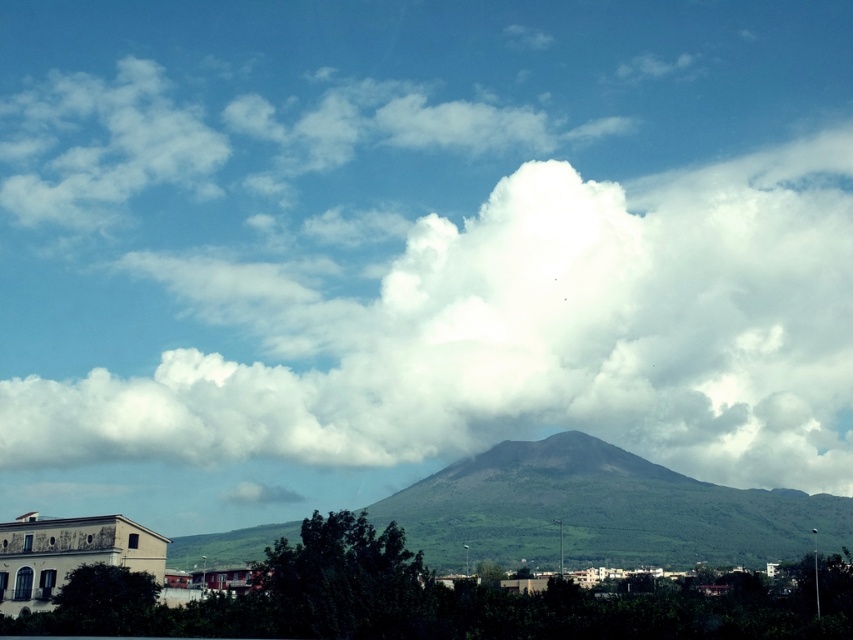
You are an architect designing a new observatory that needs a clear view of the mountain. The observatory will be built near the building on the left. Based on the image, will the white fluffy cloud at upper center block the view of the green matte mountain at center from the observatory location?

The white fluffy cloud at upper center is positioned on the right side of the green matte mountain at center, so it may partially block the view of the mountain from the observatory location near the building on the left depending on the elevation and angle of observation.

You are a drone operator planning to fly a drone from the green matte mountain at center to the white fluffy cloud at upper center. The drone has a maximum flight range of 500 feet. Based on the scene, will the drone be able to reach the cloud?

The white fluffy cloud at upper center is 568.51 feet away from the green matte mountain at center. Since the drone can only fly up to 500 feet, it will not be able to reach the cloud.

You are planning to take a photo of the green matte mountain at center and the white fluffy cloud at upper center. Which one should you focus on first if you want to capture both in the same frame without moving the camera?

The white fluffy cloud at upper center is larger in size than the green matte mountain at center, so you should focus on the white fluffy cloud at upper center first to ensure it fits properly in the frame.